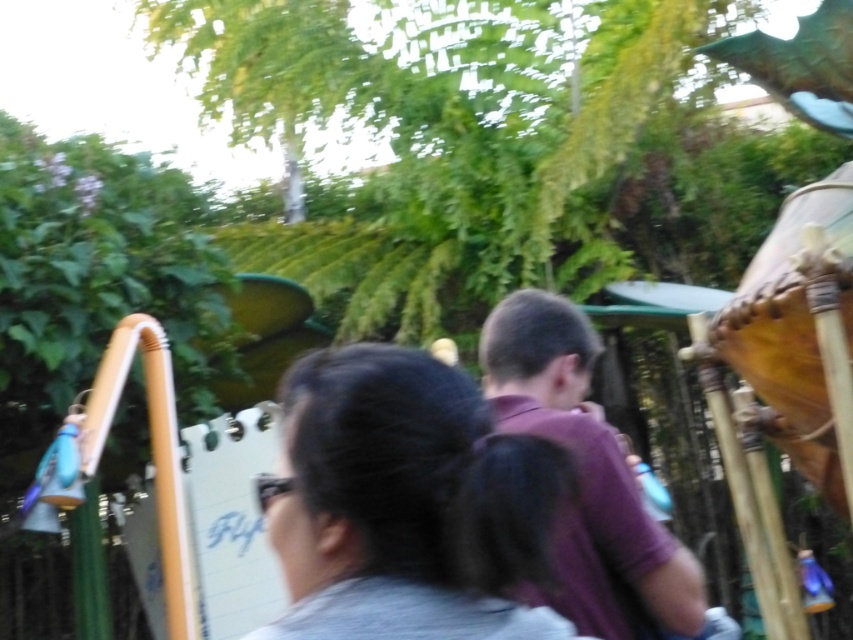
What are the coordinates of `gray matte hair at center` in the screenshot? It's located at (405, 502).

Consider the image. Is gray matte hair at center closer to the viewer compared to purple matte shirt at center?

Yes, it is in front of purple matte shirt at center.

What do you see at coordinates (405, 502) in the screenshot?
I see `gray matte hair at center` at bounding box center [405, 502].

This screenshot has width=853, height=640. In order to click on gray matte hair at center in this screenshot , I will do `click(405, 502)`.